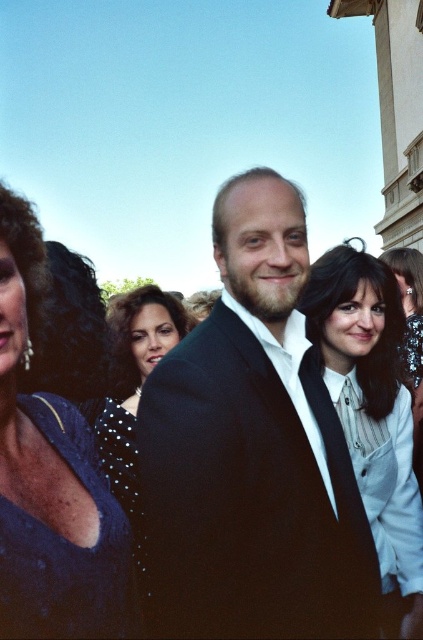
You are at a formal event and want to take a photo of both the white textured shirt at center and the black dotted dress at center. Which one is more to the right?

The white textured shirt at center is more to the right than the black dotted dress at center.

You are attending a formal event and notice two attendees wearing black matte suit at center and black dotted dress at center. Which one is closer to the front of the group?

The black matte suit at center is closer to the front of the group because it is in front of the black dotted dress at center.